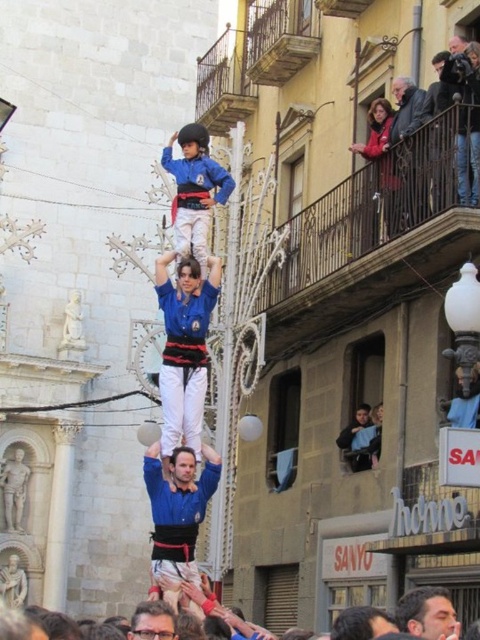
You are a photographer trying to capture the human tower in the public square. You notice two participants wearing similar blue attire. The first is dressed in a matte blue uniform at center, and the second is wearing a blue fabric shirt at center. Which participant should you focus on to ensure their clothing appears wider in your photo?

The matte blue uniform at center has a larger width than the blue fabric shirt at center, so focusing on the matte blue uniform at center will capture the wider clothing.

In the scene of the human tower construction, there are two people labeled as the blue fabric man at center and the matte blue uniform at center. Which of these two individuals is positioned higher up in the tower?

The blue fabric man at center is positioned higher up in the tower since it has a greater height compared to the matte blue uniform at center.

You are a photographer positioned at the front of the crowd watching the human tower. You want to capture a clear photo of the smooth brown hair at center without the blue fabric man at center blocking it. Is this possible given their positions?

The smooth brown hair at center is behind the blue fabric man at center, so it is blocked by him. Therefore, you cannot capture a clear photo of the smooth brown hair at center without the blue fabric man at center blocking it.